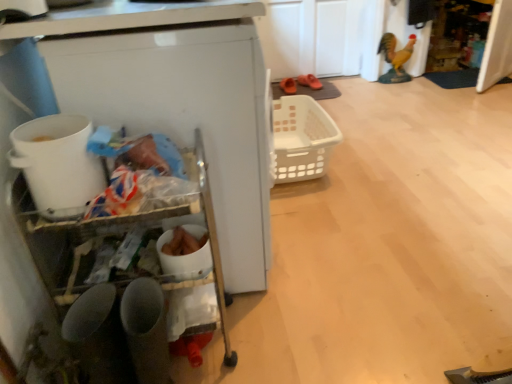
At what (x,y) coordinates should I click in order to perform the action: click on free spot in front of orange rubber clogs at center, which is the first footwear from right to left. Please return your answer as a coordinate pair (x, y). Looking at the image, I should click on (323, 95).